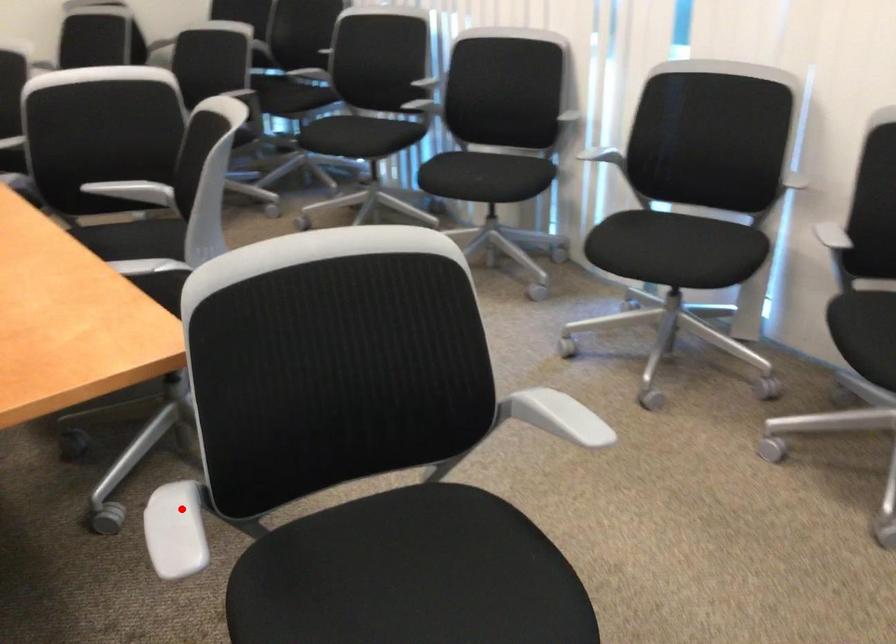
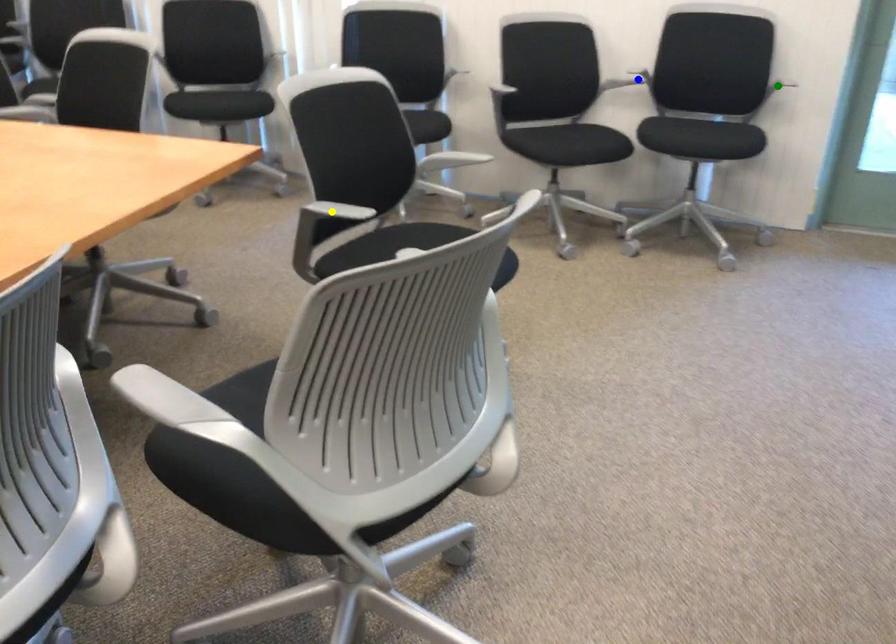
Question: I am providing you with two images of the same scene from different viewpoints. A red point is marked on the first image. You are given multiple points on the second image. Which point in image 2 represents the same 3d spot as the red point in image 1?

Choices:
 (A) green point
 (B) blue point
 (C) yellow point

Answer: (C)